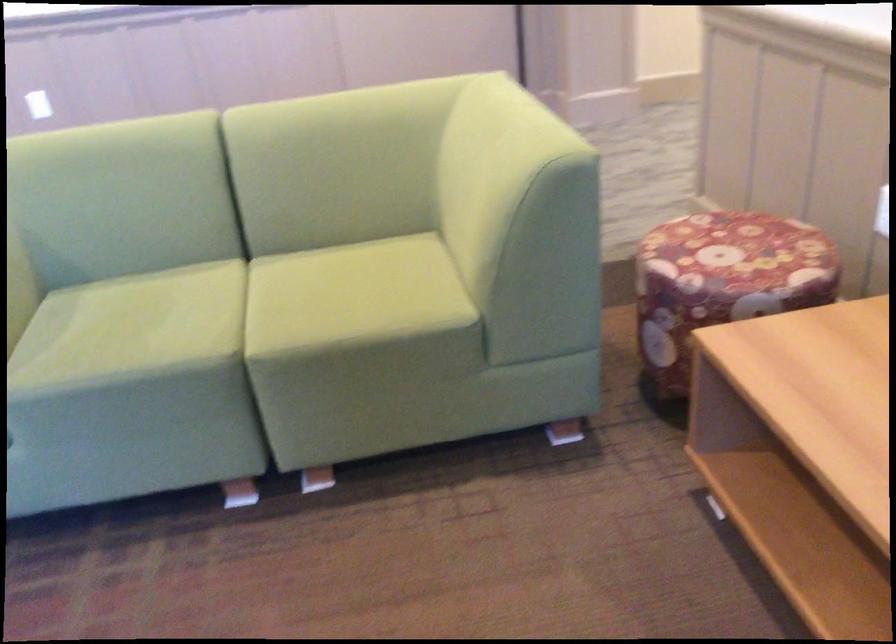
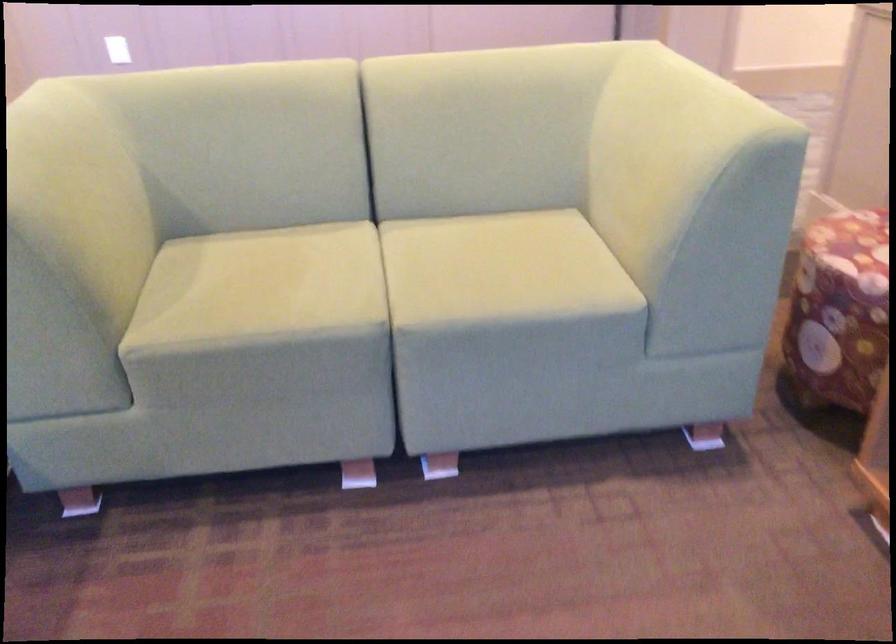
In the second image, find the point that corresponds to (x=149, y=319) in the first image.

(280, 277)